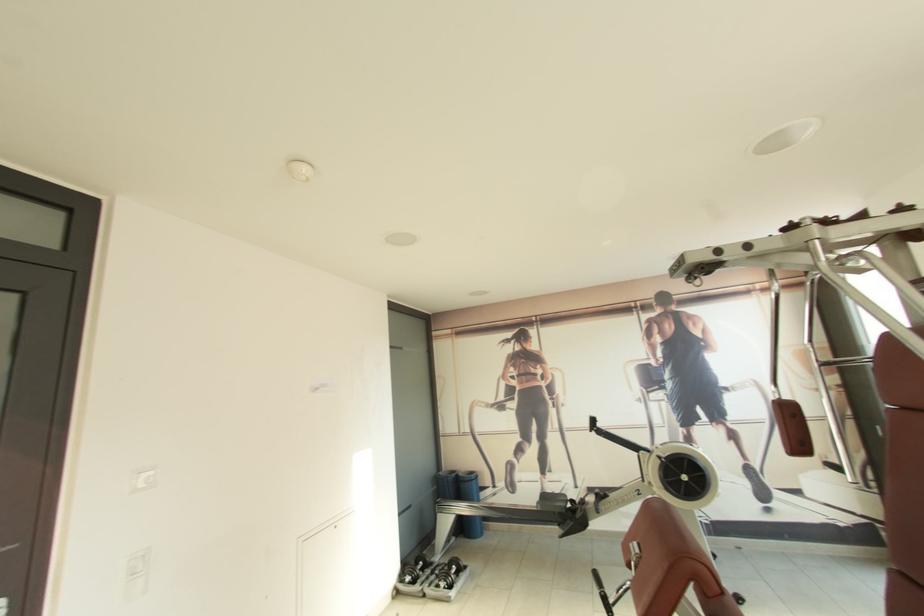
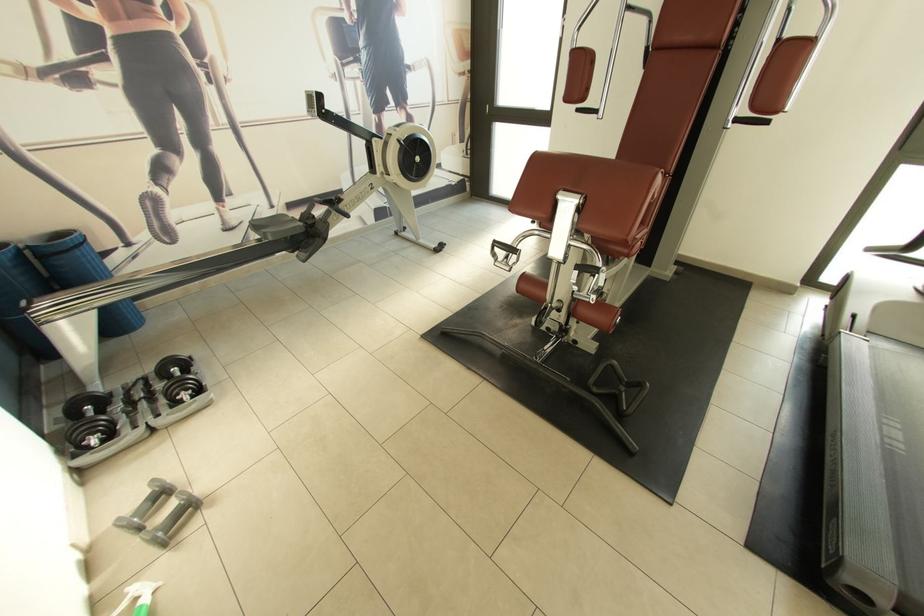
Locate, in the second image, the point that corresponds to (455,589) in the first image.

(204, 392)